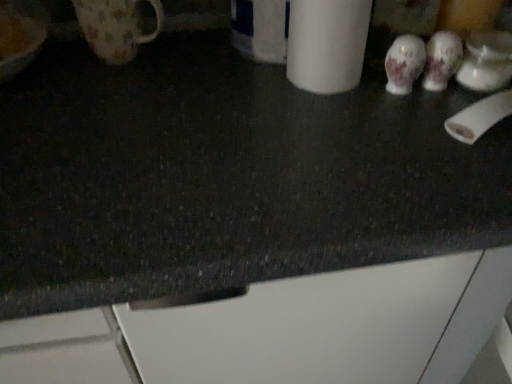
Question: Should I look upward or downward to see floral ceramic mug at upper left, the second mug from the right?

Choices:
 (A) up
 (B) down

Answer: (A)

Question: Is white matte paper towel at upper right smaller than white porcelain mug at upper right, arranged as the first mug when viewed from the right?

Choices:
 (A) yes
 (B) no

Answer: (B)

Question: Considering the relative sizes of white matte paper towel at upper right and white porcelain mug at upper right, the 2th mug from the left, in the image provided, is white matte paper towel at upper right wider than white porcelain mug at upper right, the 2th mug from the left,?

Choices:
 (A) yes
 (B) no

Answer: (A)

Question: Are white matte paper towel at upper right and white porcelain mug at upper right, arranged as the first mug when viewed from the right, beside each other?

Choices:
 (A) no
 (B) yes

Answer: (A)

Question: From the image's perspective, is white matte paper towel at upper right located beneath white porcelain mug at upper right, arranged as the first mug when viewed from the right?

Choices:
 (A) yes
 (B) no

Answer: (B)

Question: Is white matte paper towel at upper right further to camera compared to white porcelain mug at upper right, arranged as the first mug when viewed from the right?

Choices:
 (A) no
 (B) yes

Answer: (A)

Question: Is white matte paper towel at upper right oriented towards white porcelain mug at upper right, arranged as the first mug when viewed from the right?

Choices:
 (A) no
 (B) yes

Answer: (A)

Question: Does white matte paper towel at upper right have a greater width compared to white matte toilet paper at right?

Choices:
 (A) no
 (B) yes

Answer: (B)

Question: Does white matte paper towel at upper right appear on the right side of white matte toilet paper at right?

Choices:
 (A) no
 (B) yes

Answer: (A)

Question: From a real-world perspective, is white matte paper towel at upper right located beneath white matte toilet paper at right?

Choices:
 (A) no
 (B) yes

Answer: (A)

Question: Can you confirm if white matte paper towel at upper right is taller than white matte toilet paper at right?

Choices:
 (A) yes
 (B) no

Answer: (A)

Question: Is white matte paper towel at upper right shorter than white matte toilet paper at right?

Choices:
 (A) no
 (B) yes

Answer: (A)

Question: Could you tell me if white matte paper towel at upper right is facing white matte toilet paper at right?

Choices:
 (A) no
 (B) yes

Answer: (A)

Question: Does white porcelain mug at upper right, the 2th mug from the left, have a greater width compared to white matte paper towel at upper right?

Choices:
 (A) no
 (B) yes

Answer: (A)